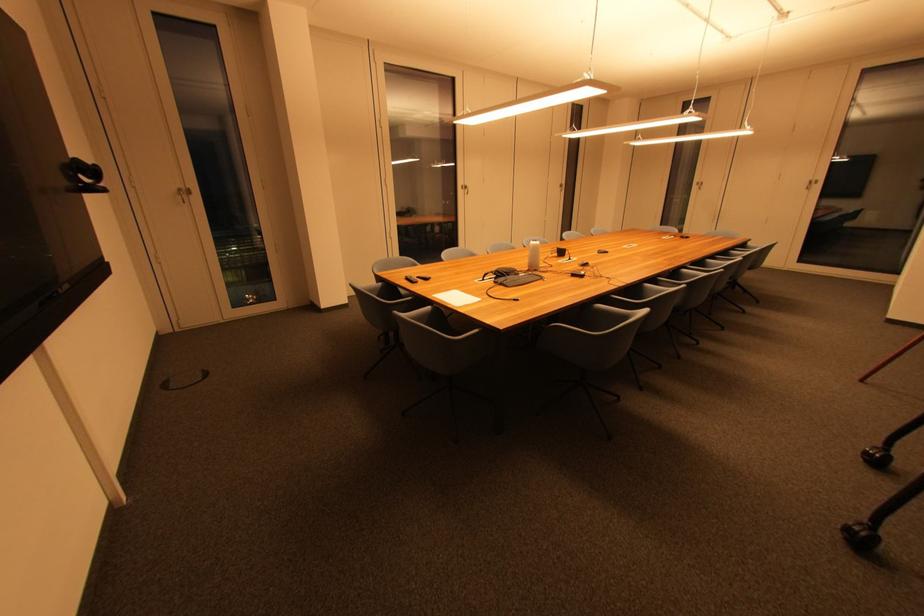
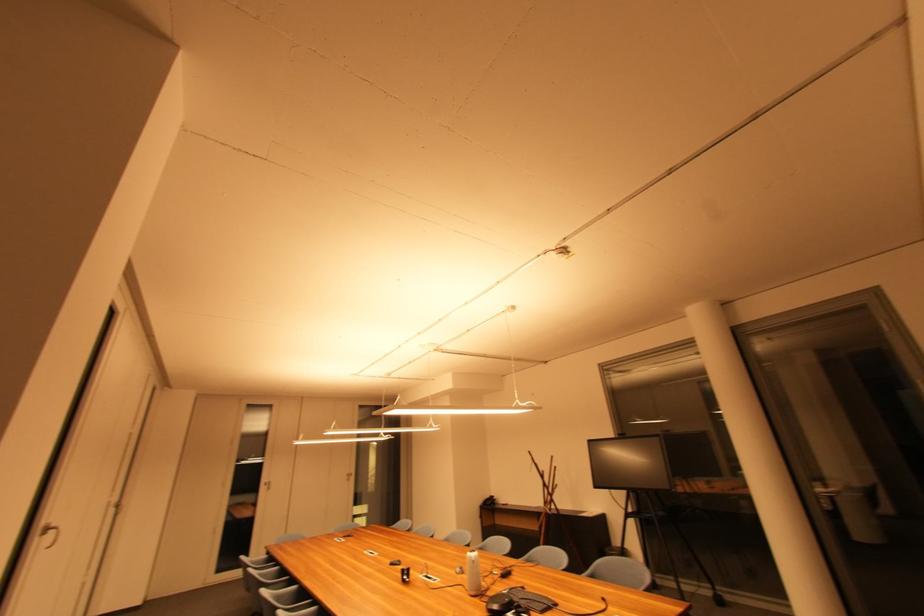
Locate, in the second image, the point that corresponds to (703,185) in the first image.

(271, 485)